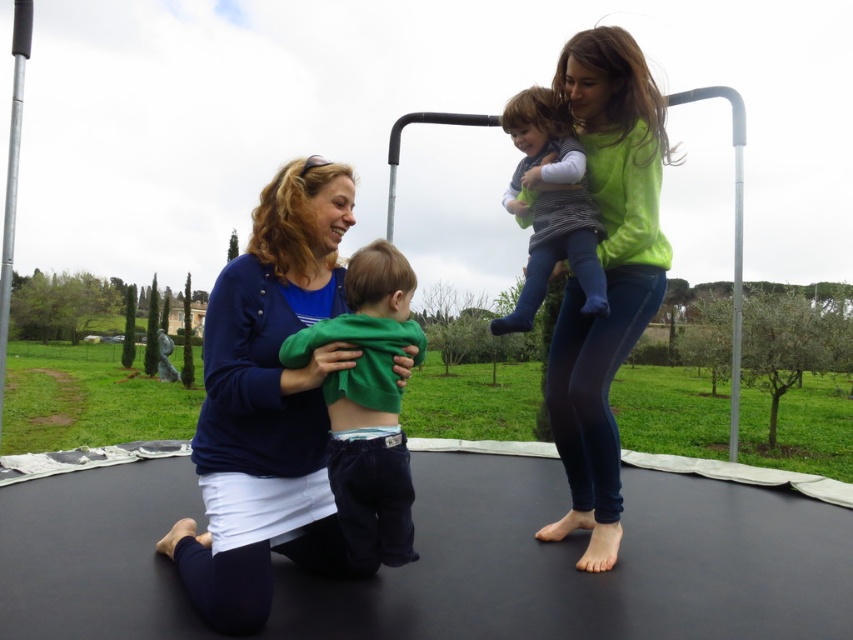
You are standing in front of the trampoline and see the blue fabric at center and the green matte hoodie at center. Which one is nearer to you?

The blue fabric at center is closer to the viewer than the green matte hoodie at center.

You are standing at the center of the black trampoline with a white border. You want to reach the green matte sweater at upper right. Which direction should you move to get closer to it?

The green matte sweater at upper right is located at point (606, 273), so you should move towards the upper right direction from the center of the black trampoline with a white border to reach it.

You are standing on the trampoline and want to reach both the blue fabric at center and the green matte sweater at upper right. Which one is closer to the sky?

→ The green matte sweater at upper right is closer to the sky because it has a greater height than the blue fabric at center.